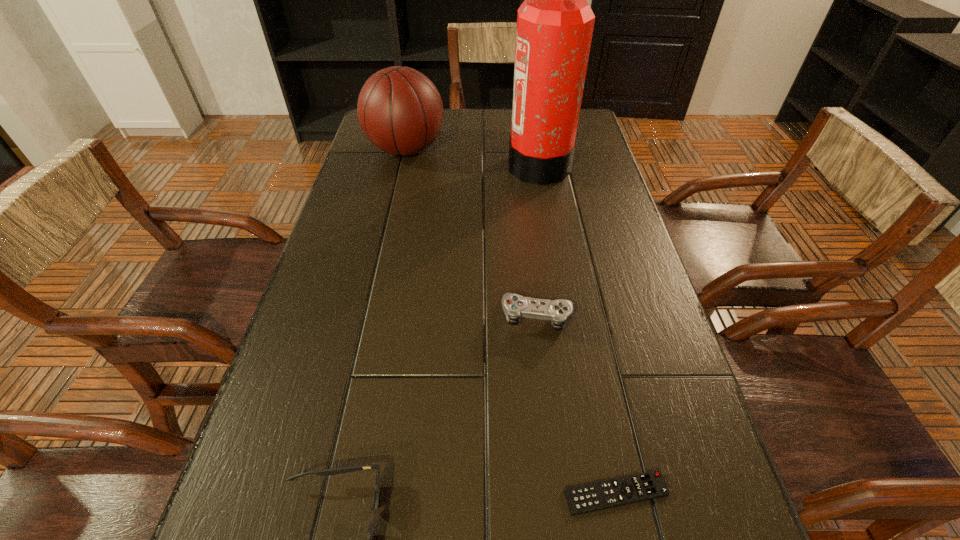
Find the location of a particular element. Image resolution: width=960 pixels, height=540 pixels. vacant point located 0.200m on the back of the remote control is located at coordinates (589, 363).

Where is `fire extinguisher that is at the far edge`? This screenshot has width=960, height=540. fire extinguisher that is at the far edge is located at coordinates (555, 23).

The width and height of the screenshot is (960, 540). I want to click on basketball located at the far edge, so (x=400, y=110).

You are a GUI agent. You are given a task and a screenshot of the screen. Output one action in this format:
    pyautogui.click(x=<x>, y=<y>)
    Task: Click on the object at the left edge
    The width and height of the screenshot is (960, 540).
    Given the screenshot: What is the action you would take?
    click(x=400, y=110)

This screenshot has height=540, width=960. Find the location of `fire extinguisher present at the right edge`. fire extinguisher present at the right edge is located at coordinates (555, 23).

Image resolution: width=960 pixels, height=540 pixels. I want to click on remote control that is at the right edge, so click(x=605, y=494).

Where is `object located in the far left corner section of the desktop`? Image resolution: width=960 pixels, height=540 pixels. object located in the far left corner section of the desktop is located at coordinates (400, 110).

Where is `object that is at the far right corner`? object that is at the far right corner is located at coordinates (555, 23).

Image resolution: width=960 pixels, height=540 pixels. I want to click on vacant space at the far edge of the desktop, so click(x=454, y=109).

Where is `vacant space at the left edge of the desktop`? This screenshot has width=960, height=540. vacant space at the left edge of the desktop is located at coordinates (249, 504).